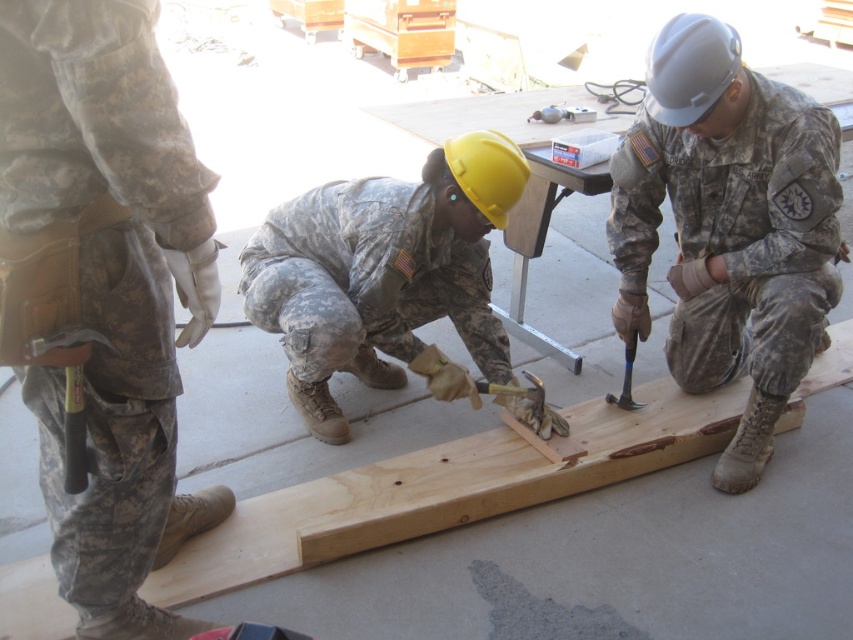
In the scene shown: Is camouflage fabric pants at center positioned before matte gray helmet at center?

Yes.

Which is above, camouflage fabric pants at center or matte gray helmet at center?

matte gray helmet at center is higher up.

Is point (183, 502) more distant than point (730, 124)?

No, it is in front of (730, 124).

This screenshot has width=853, height=640. I want to click on camouflage fabric pants at center, so click(103, 291).

Does point (494, 161) lie behind point (624, 349)?

No, (494, 161) is closer to viewer.

What are the coordinates of `yellow matte helmet at center` in the screenshot? It's located at (386, 275).

Does matte gray helmet at center appear under yellow matte helmet at center?

Actually, matte gray helmet at center is above yellow matte helmet at center.

Can you confirm if matte gray helmet at center is positioned to the right of yellow matte helmet at center?

Indeed, matte gray helmet at center is positioned on the right side of yellow matte helmet at center.

Identify the location of matte gray helmet at center. (729, 227).

Find the location of `matte gray helmet at center`. matte gray helmet at center is located at coordinates (729, 227).